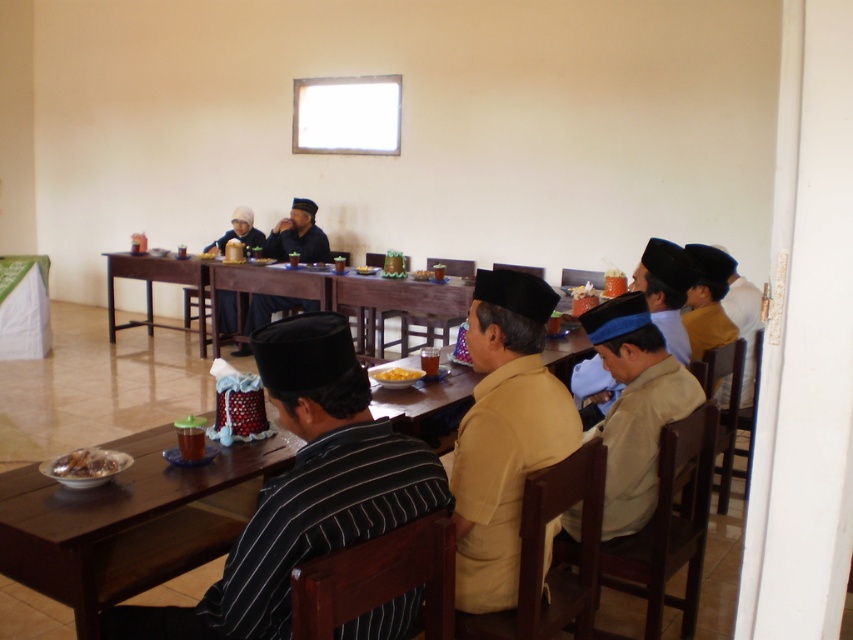
Question: Which of the following is the farthest from the observer?

Choices:
 (A) green fabric table at lower left
 (B) matte black headscarf at center
 (C) blue felt hat at right

Answer: (B)

Question: Does shiny metallic plate at lower left appear over yellow matte bowl at center?

Choices:
 (A) no
 (B) yes

Answer: (A)

Question: Is blue fabric headscarf at right above shiny metallic plate at lower left?

Choices:
 (A) yes
 (B) no

Answer: (A)

Question: Which is nearer to the matte black hat at upper center?

Choices:
 (A) matte black headscarf at center
 (B) striped fabric shirt at center
 (C) green fabric table at lower left
 (D) brown wooden table at lower left

Answer: (A)

Question: Does green fabric table at lower left appear under brown wooden table at center?

Choices:
 (A) yes
 (B) no

Answer: (A)

Question: Estimate the real-world distances between objects in this image. Which object is closer to the matte black hat at upper center?

Choices:
 (A) shiny metallic plate at lower left
 (B) brown wooden table at center
 (C) blue felt hat at right

Answer: (B)